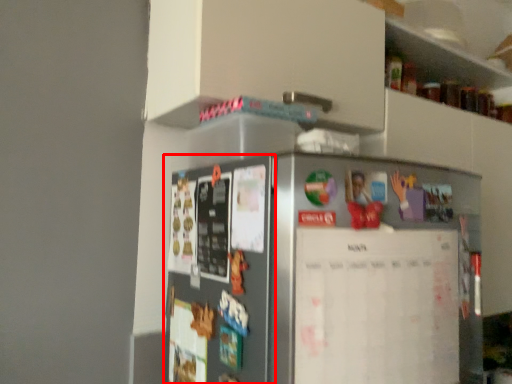
Question: From the image, what is the correct spatial relationship of fridge (annotated by the red box) in relation to bulletin board?

Choices:
 (A) left
 (B) right

Answer: (A)